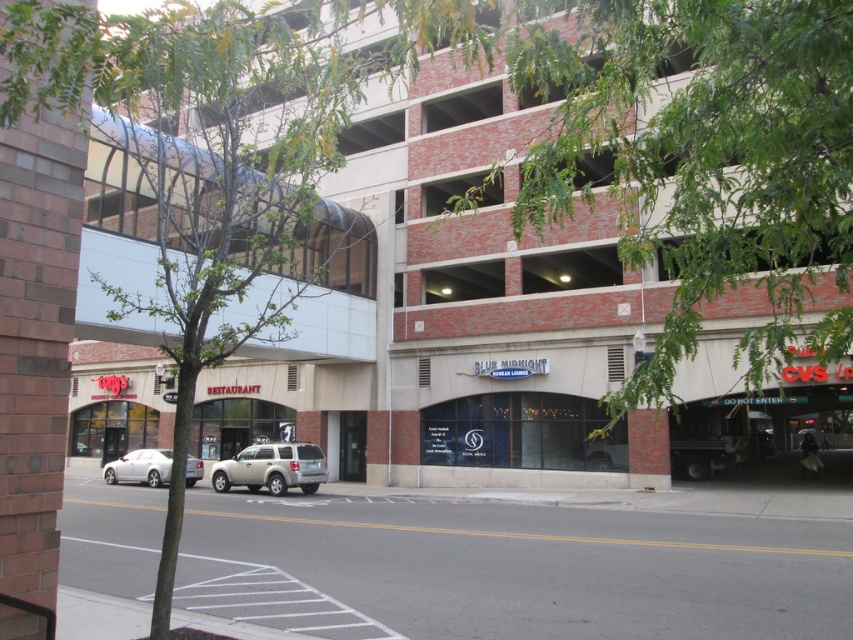
You are a delivery driver who needs to park your vehicle, which is 1.5 meters tall, in one of the parking spaces near the brick wall parking garage at center and the silver metallic sedan at lower left. Based on the scene, can your vehicle fit vertically between these two objects without hitting anything?

The brick wall parking garage at center is taller than the silver metallic sedan at lower left. Since the garage is taller, your vehicle which is 1.5 meters tall can fit vertically between them as the height is sufficient.

You are standing on the sidewalk in front of Tony s Restaurant. You want to take a photo of the green leafy tree at upper center. Where should you position yourself to get the best view of it?

The green leafy tree at upper center is located at point [700,157]. To capture it in your photo, position yourself directly in front of Tony s Restaurant and look upward toward the upper center of the building to frame the tree in the center of your shot.